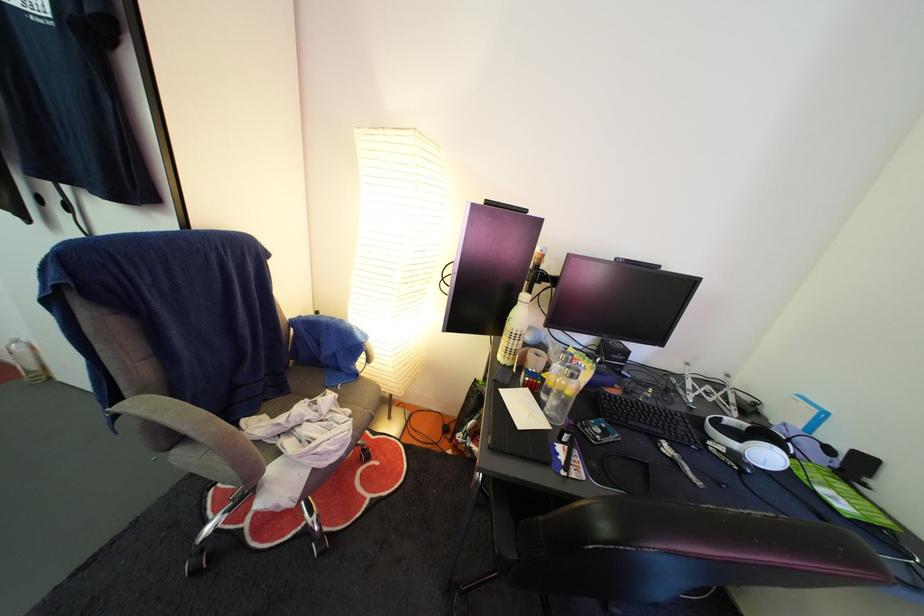
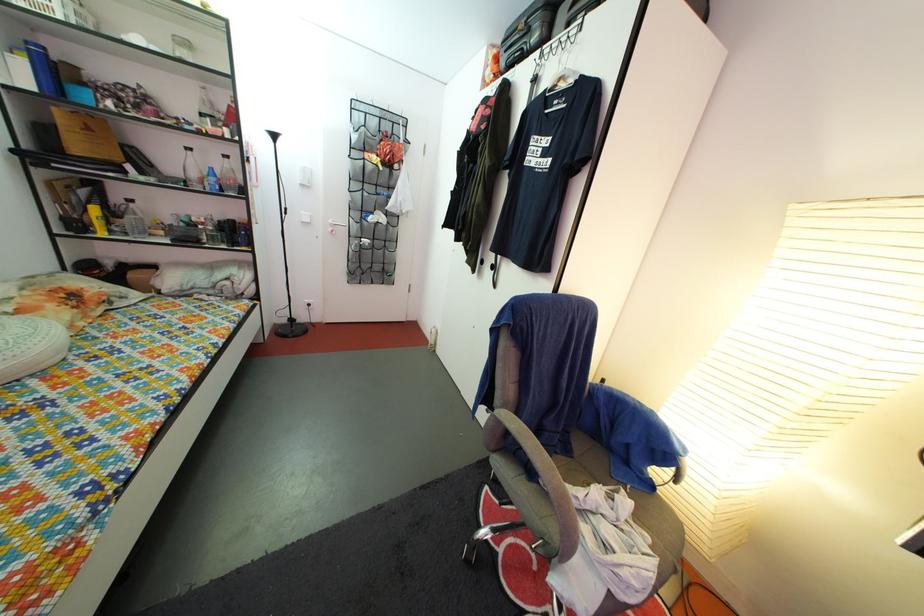
Where in the second image is the point corresponding to (x=135, y=400) from the first image?

(505, 410)